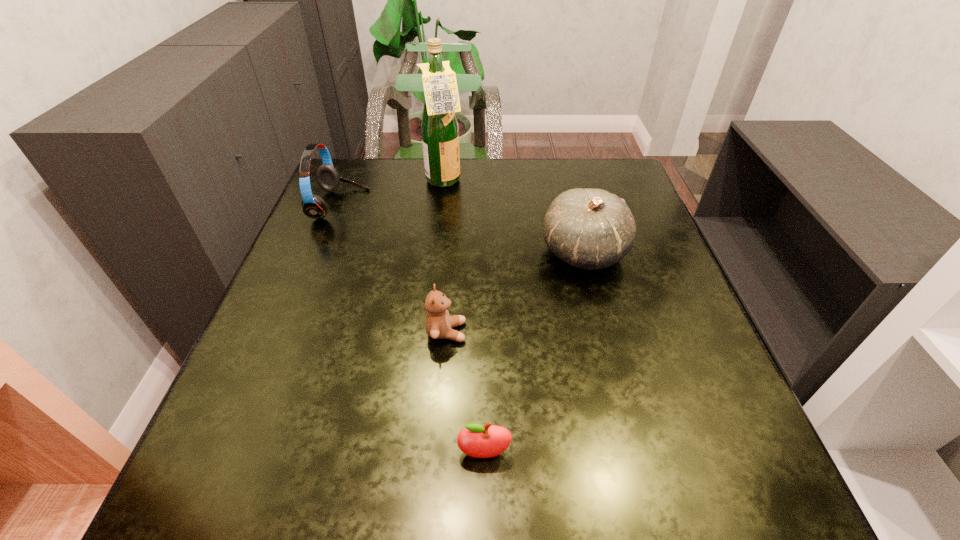
I want to click on liquor, so click(440, 135).

Identify the location of the leftmost object. (313, 206).

This screenshot has width=960, height=540. I want to click on the rightmost object, so click(591, 229).

Identify the location of the second nearest object. (439, 324).

What are the coordinates of `the second shortest object` in the screenshot? It's located at (439, 324).

You are a GUI agent. You are given a task and a screenshot of the screen. Output one action in this format:
    pyautogui.click(x=<x>, y=<y>)
    Task: Click on the apple
    This screenshot has height=540, width=960.
    Given the screenshot: What is the action you would take?
    pyautogui.click(x=476, y=440)

Find the location of a particular element. the nearest object is located at coordinates (476, 440).

The height and width of the screenshot is (540, 960). I want to click on blank space located on the front-facing side of the liquor, so 519,183.

Locate an element on the screen. The width and height of the screenshot is (960, 540). vacant region located with the microphone attached to the side of the leftmost object is located at coordinates (411, 205).

Find the location of a particular element. Image resolution: width=960 pixels, height=540 pixels. vacant region located on the front of the rightmost object is located at coordinates (632, 436).